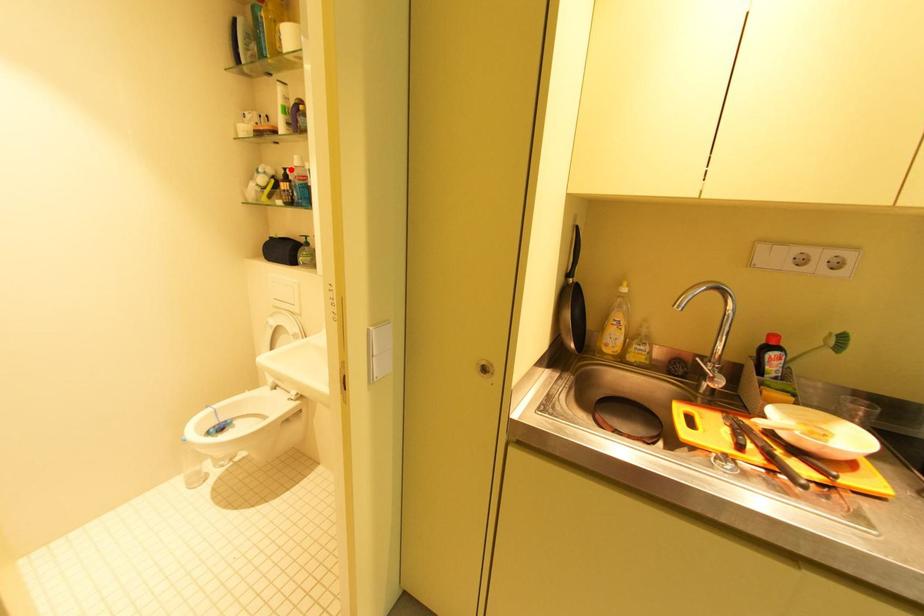
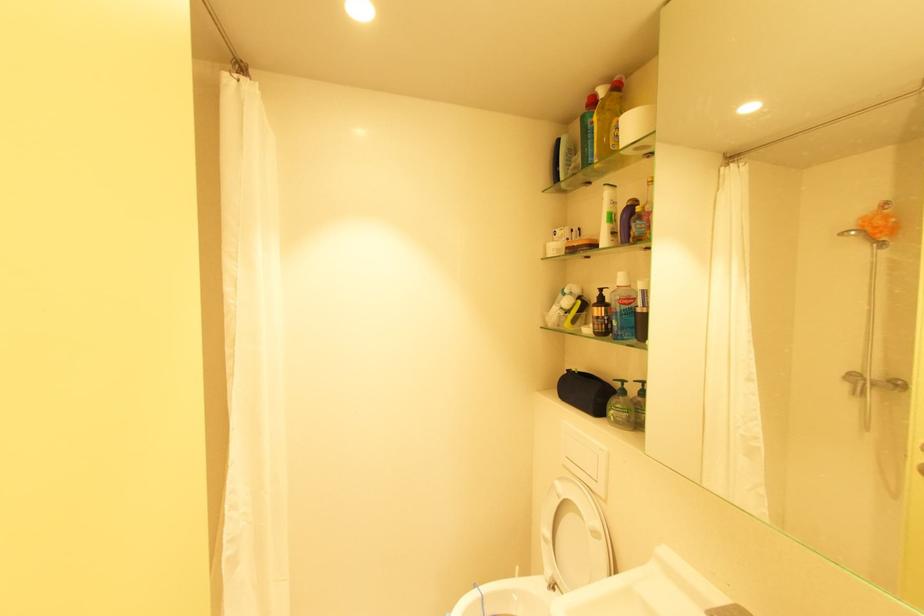
In the second image, find the point that corresponds to the highlighted location in the first image.

(606, 291)